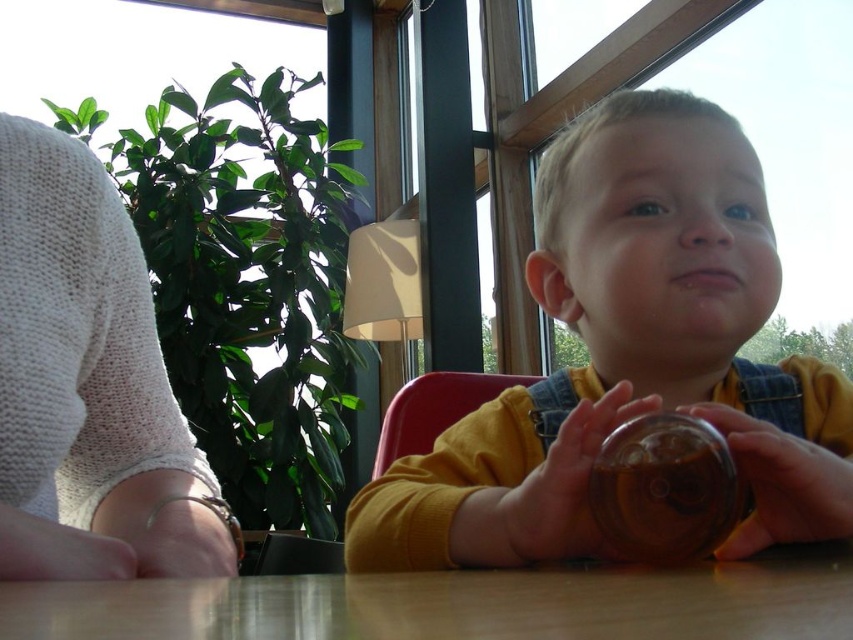
Question: Is smooth beige bracelet at lower left below red plastic chair at center?

Choices:
 (A) yes
 (B) no

Answer: (B)

Question: Considering the real-world distances, which object is closest to the red plastic chair at center?

Choices:
 (A) translucent plastic cup at center
 (B) wooden table at center

Answer: (B)

Question: Can you confirm if matte yellow shirt at center is wider than translucent plastic cup at center?

Choices:
 (A) yes
 (B) no

Answer: (A)

Question: Which object is closer to the camera taking this photo?

Choices:
 (A) matte yellow shirt at center
 (B) translucent plastic cup at center
 (C) red plastic chair at center
 (D) translucent glass cup at center

Answer: (A)

Question: Is translucent plastic cup at lower center thinner than translucent plastic cup at center?

Choices:
 (A) no
 (B) yes

Answer: (B)

Question: Estimate the real-world distances between objects in this image. Which object is farther from the wooden table at center?

Choices:
 (A) matte yellow shirt at center
 (B) red plastic chair at center
 (C) translucent glass cup at center
 (D) smooth beige bracelet at lower left

Answer: (B)